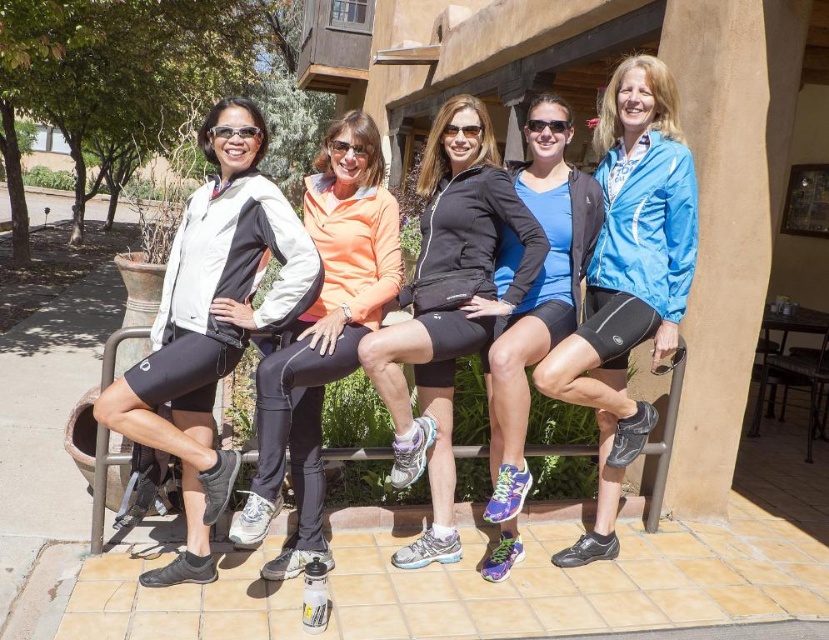
You are standing on the tiled patio and want to place a small potted plant between the two points, point (x=394, y=436) and point (x=529, y=172). Since you want the plant to be closer to the viewer, which point should you position it nearer to?

You should position the plant nearer to point (x=394, y=436) because it is closer to the viewer than point (x=529, y=172).